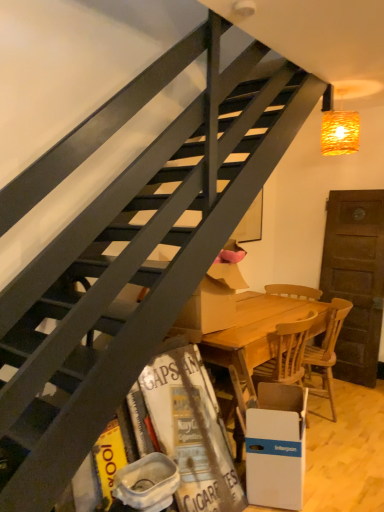
Question: Can you confirm if wooden at under stairs, which is the first chair in left-to-right order, is bigger than white cardboard box at lower right?

Choices:
 (A) yes
 (B) no

Answer: (A)

Question: Does wooden at under stairs, the 2th chair in the right-to-left sequence, have a lesser width compared to white cardboard box at lower right?

Choices:
 (A) no
 (B) yes

Answer: (A)

Question: From a real-world perspective, is wooden at under stairs, which is the first chair in left-to-right order, under white cardboard box at lower right?

Choices:
 (A) no
 (B) yes

Answer: (A)

Question: Can you confirm if wooden at under stairs, which is the first chair in left-to-right order, is taller than white cardboard box at lower right?

Choices:
 (A) no
 (B) yes

Answer: (B)

Question: Considering the relative sizes of wooden at under stairs, the 2th chair in the right-to-left sequence, and white cardboard box at lower right in the image provided, is wooden at under stairs, the 2th chair in the right-to-left sequence, shorter than white cardboard box at lower right?

Choices:
 (A) yes
 (B) no

Answer: (B)

Question: Is wooden at under stairs, which is the first chair in left-to-right order, at the right side of white cardboard box at lower right?

Choices:
 (A) yes
 (B) no

Answer: (A)

Question: From a real-world perspective, does white cardboard box at lower right sit lower than wooden at lower right, which appears as the 1th chair when viewed from the right?

Choices:
 (A) no
 (B) yes

Answer: (B)

Question: Are white cardboard box at lower right and wooden at lower right, which appears as the 1th chair when viewed from the right, making contact?

Choices:
 (A) yes
 (B) no

Answer: (B)

Question: Considering the relative positions of white cardboard box at lower right and wooden at lower right, which appears as the 1th chair when viewed from the right, in the image provided, is white cardboard box at lower right behind wooden at lower right, which appears as the 1th chair when viewed from the right,?

Choices:
 (A) no
 (B) yes

Answer: (A)

Question: From a real-world perspective, is white cardboard box at lower right positioned over wooden at lower right, which appears as the 1th chair when viewed from the right, based on gravity?

Choices:
 (A) yes
 (B) no

Answer: (B)

Question: Is white cardboard box at lower right bigger than wooden at lower right, the 2th chair viewed from the left?

Choices:
 (A) yes
 (B) no

Answer: (B)

Question: Considering the relative sizes of white cardboard box at lower right and wooden at lower right, the 2th chair viewed from the left, in the image provided, is white cardboard box at lower right thinner than wooden at lower right, the 2th chair viewed from the left,?

Choices:
 (A) no
 (B) yes

Answer: (B)

Question: Considering the relative sizes of white plastic trash bin/can at lower center and wooden at lower right, the 2th chair viewed from the left, in the image provided, is white plastic trash bin/can at lower center thinner than wooden at lower right, the 2th chair viewed from the left,?

Choices:
 (A) yes
 (B) no

Answer: (A)